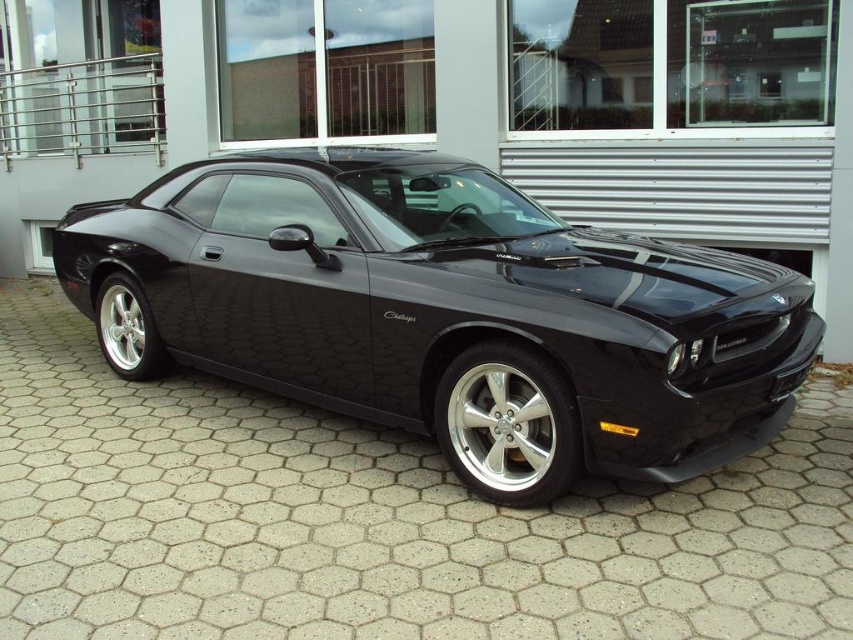
Question: Which of the following is the closest to the observer?

Choices:
 (A) black asphalt driveway at center
 (B) glossy black car at center

Answer: (A)

Question: Is black asphalt driveway at center to the left of glossy black car at center from the viewer's perspective?

Choices:
 (A) yes
 (B) no

Answer: (B)

Question: Considering the relative positions of black asphalt driveway at center and glossy black car at center in the image provided, where is black asphalt driveway at center located with respect to glossy black car at center?

Choices:
 (A) below
 (B) above

Answer: (A)

Question: Among these points, which one is farthest from the camera?

Choices:
 (A) (764, 321)
 (B) (635, 556)

Answer: (A)

Question: From the image, what is the correct spatial relationship of black asphalt driveway at center in relation to glossy black car at center?

Choices:
 (A) below
 (B) above

Answer: (A)